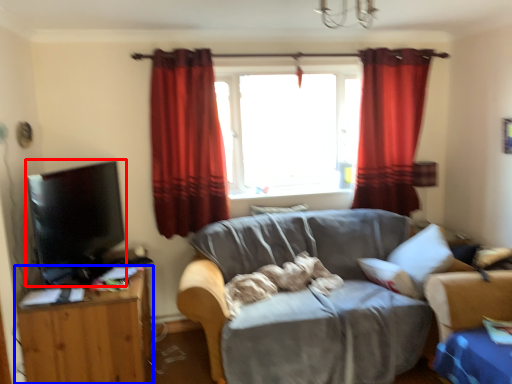
Question: Which of the following is the farthest to the observer, flat (highlighted by a red box) or table (highlighted by a blue box)?

Choices:
 (A) flat
 (B) table

Answer: (B)